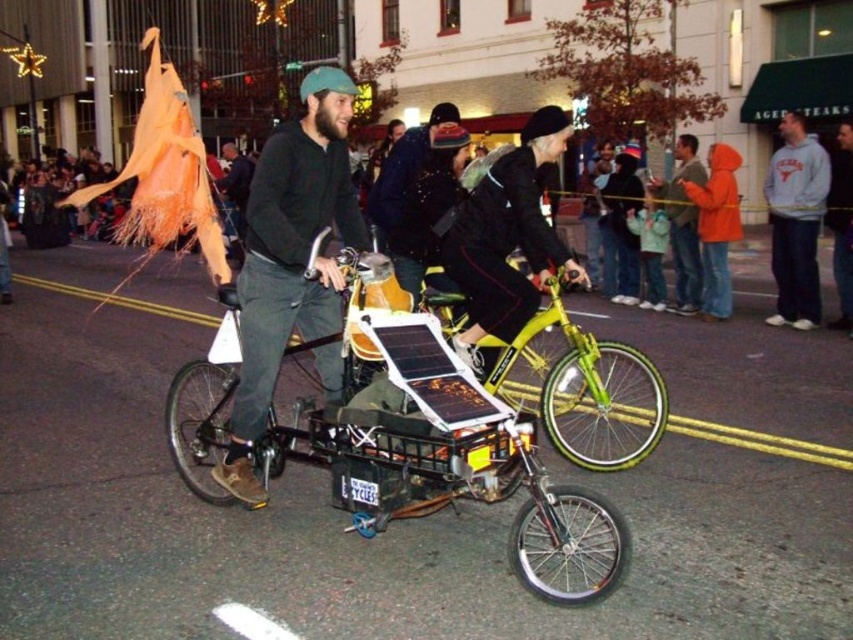
Does dark gray fleece jacket at center have a lesser height compared to black matte jacket at center?

No, dark gray fleece jacket at center is not shorter than black matte jacket at center.

Does point (332, 184) come in front of point (534, 230)?

Yes, it is.

You are a GUI agent. You are given a task and a screenshot of the screen. Output one action in this format:
    pyautogui.click(x=<x>, y=<y>)
    Task: Click on the dark gray fleece jacket at center
    The height and width of the screenshot is (640, 853).
    Given the screenshot: What is the action you would take?
    pyautogui.click(x=289, y=259)

Does dark gray fleece jacket at center have a lesser width compared to metallic yellow bicycle at center?

Yes.

Does dark gray fleece jacket at center have a smaller size compared to metallic yellow bicycle at center?

Indeed, dark gray fleece jacket at center has a smaller size compared to metallic yellow bicycle at center.

Is point (274, 225) positioned in front of point (527, 365)?

Yes, it is.

The width and height of the screenshot is (853, 640). Identify the location of dark gray fleece jacket at center. (289, 259).

The image size is (853, 640). Describe the element at coordinates (506, 237) in the screenshot. I see `black matte jacket at center` at that location.

Does black matte jacket at center have a larger size compared to gray fleece sweatshirt at upper right?

Yes, black matte jacket at center is bigger than gray fleece sweatshirt at upper right.

Which is behind, point (573, 273) or point (799, 129)?

The point (799, 129) is behind.

At what (x,y) coordinates should I click in order to perform the action: click on black matte jacket at center. Please return your answer as a coordinate pair (x, y). Looking at the image, I should click on (506, 237).